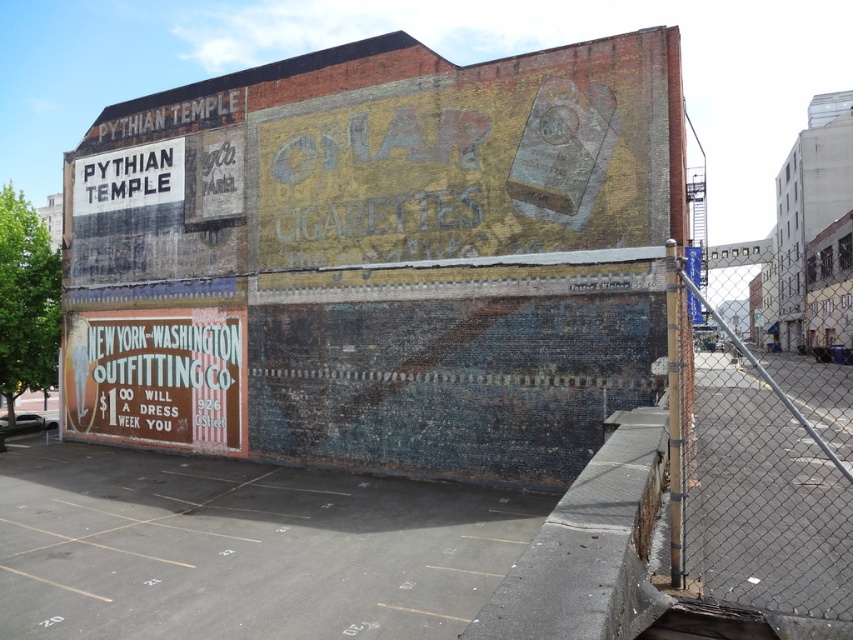
Consider the image. You are standing in front of the brick wall with vintage advertisements. There are two points marked on the wall at coordinates point [322,68] and point [844,499]. Which point is closer to you?

Point [322,68] is further to the camera than point [844,499]. Therefore, point [844,499] is closer to you.